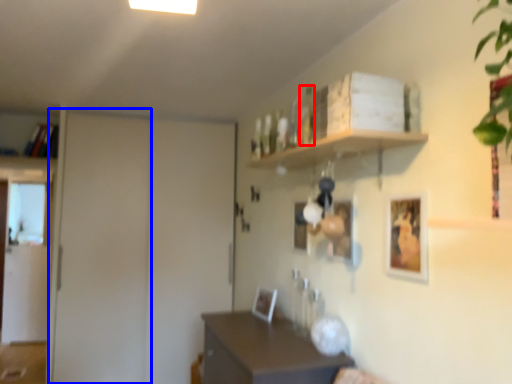
Question: Which point is closer to the camera, bottle (highlighted by a red box) or door (highlighted by a blue box)?

Choices:
 (A) bottle
 (B) door

Answer: (A)